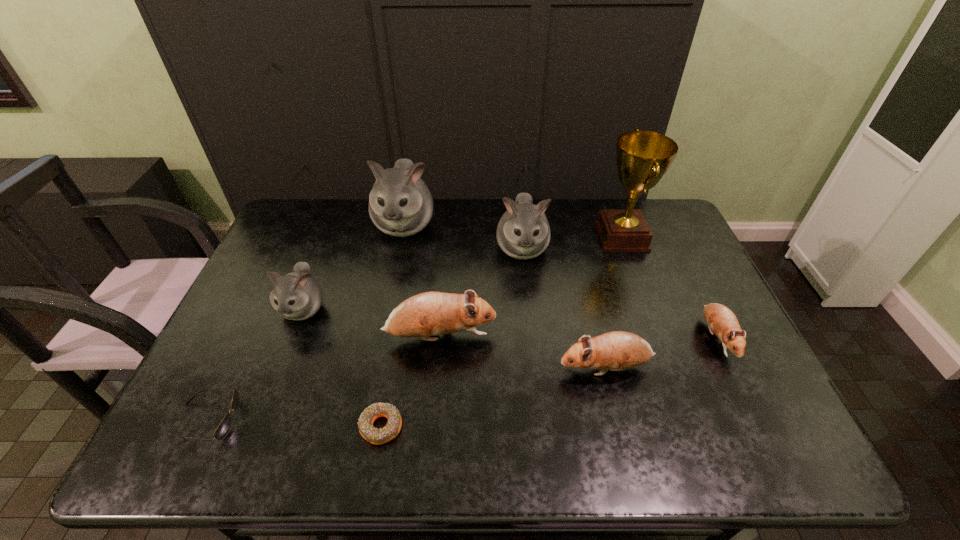
I want to click on vacant space situated on the face of the second smallest white hamster, so click(526, 289).

Where is `vacant area situated 0.340m on the face of the smallest white hamster`? vacant area situated 0.340m on the face of the smallest white hamster is located at coordinates (246, 458).

The width and height of the screenshot is (960, 540). Identify the location of free space located at the face of the biggest brown hamster. (566, 337).

This screenshot has width=960, height=540. Find the location of `free spot located 0.380m at the face of the sixth tallest object`. free spot located 0.380m at the face of the sixth tallest object is located at coordinates pyautogui.click(x=407, y=368).

The height and width of the screenshot is (540, 960). I want to click on vacant space located 0.060m at the face of the sixth tallest object, so click(x=534, y=368).

What are the coordinates of `free space located at the face of the sixth tallest object` in the screenshot? It's located at (494, 368).

Identify the location of vacant area located at the face of the smallest brown hamster. The image size is (960, 540). (745, 398).

Where is `blank area located 0.130m on the front-facing side of the sunglasses`? blank area located 0.130m on the front-facing side of the sunglasses is located at coordinates (294, 419).

Locate an element on the screen. free space located 0.310m on the back of the doughnut is located at coordinates (401, 309).

Where is `award located at the far edge`? This screenshot has height=540, width=960. award located at the far edge is located at coordinates click(x=643, y=157).